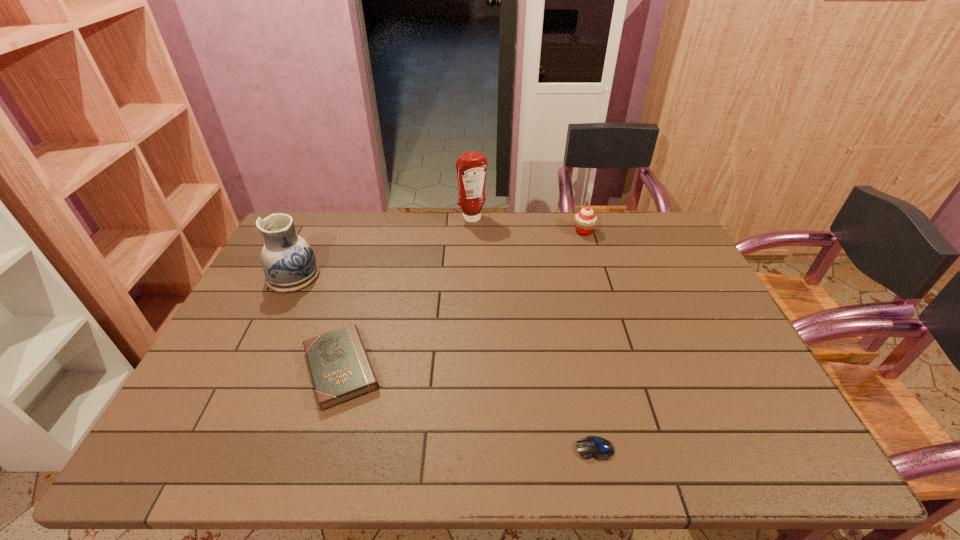
Identify the location of object that is at the left edge. (289, 264).

In the image, there is a desktop. Find the location of `vacant space at the far edge`. vacant space at the far edge is located at coordinates (566, 220).

This screenshot has height=540, width=960. Identify the location of vacant space at the near edge of the desktop. (420, 443).

This screenshot has height=540, width=960. What are the coordinates of `vacant position at the right edge of the desktop` in the screenshot? It's located at (744, 389).

Find the location of `vacant region at the far left corner of the desktop`. vacant region at the far left corner of the desktop is located at coordinates pyautogui.click(x=328, y=219).

At what (x,y) coordinates should I click in order to perform the action: click on free space at the near right corner of the desktop. Please return your answer as a coordinate pair (x, y). Looking at the image, I should click on (742, 458).

Find the location of a particular element. The height and width of the screenshot is (540, 960). free space between the leftmost object and the second shortest object is located at coordinates tap(317, 322).

Locate an element on the screen. This screenshot has width=960, height=540. vacant space in between the fourth object from right to left and the third object from right to left is located at coordinates click(x=407, y=293).

Locate an element on the screen. The image size is (960, 540). free point between the Bible and the pottery is located at coordinates (317, 322).

Locate an element on the screen. The height and width of the screenshot is (540, 960). free space between the rightmost object and the condiment is located at coordinates [528, 225].